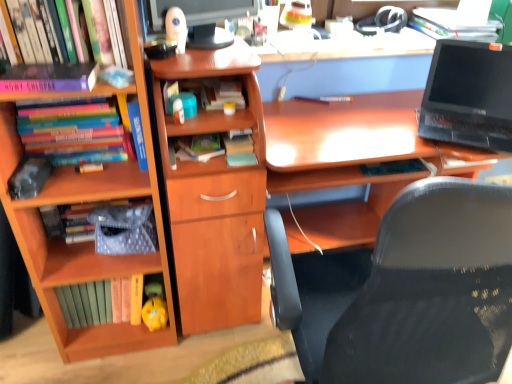
What do you see at coordinates (469, 95) in the screenshot?
I see `black plastic laptop at right` at bounding box center [469, 95].

What do you see at coordinates (87, 242) in the screenshot? I see `wooden bookcase at left` at bounding box center [87, 242].

Describe the element at coordinates (221, 94) in the screenshot. I see `hardcover book at center, the 2th book when ordered from right to left` at that location.

Measure the distance between point (233,90) and camera.

Point (233,90) and camera are 1.34 meters apart.

The image size is (512, 384). I want to click on hardcover book at center, the fourth book when ordered from left to right, so click(x=201, y=146).

This screenshot has height=384, width=512. Describe the element at coordinates (453, 25) in the screenshot. I see `matte black laptop at upper right, the first book when ordered from right to left` at that location.

The height and width of the screenshot is (384, 512). Identify the location of wooden cabinet at center. (215, 198).

From a real-world perspective, which object stands above the other?

In real-world perspective, matte black laptop at upper right, placed as the sixth book when sorted from left to right, is above.

Is black mesh chair at center inside or outside of matte black laptop at upper right, the first book when ordered from right to left?

black mesh chair at center is spatially situated outside matte black laptop at upper right, the first book when ordered from right to left.

In the scene shown: Is black mesh chair at center to the right of matte black laptop at upper right, the first book when ordered from right to left, from the viewer's perspective?

In fact, black mesh chair at center is to the left of matte black laptop at upper right, the first book when ordered from right to left.

Looking at this image, measure the distance from black mesh chair at center to matte black laptop at upper right, the first book when ordered from right to left.

The distance of black mesh chair at center from matte black laptop at upper right, the first book when ordered from right to left, is 1.11 meters.

In the scene shown: Which of these two, hardcover books at left, which ranks as the second book in left-to-right order, or pink matte book at upper left, marked as the 3th book in a left-to-right arrangement, stands shorter?

Standing shorter between the two is pink matte book at upper left, marked as the 3th book in a left-to-right arrangement.

Could you measure the distance between hardcover books at left, placed as the 5th book when sorted from right to left, and pink matte book at upper left, marked as the 3th book in a left-to-right arrangement?

hardcover books at left, placed as the 5th book when sorted from right to left, is 9.24 inches from pink matte book at upper left, marked as the 3th book in a left-to-right arrangement.

From the picture: Is hardcover books at left, which ranks as the second book in left-to-right order, located outside pink matte book at upper left, the fourth book viewed from the right?

That's correct, hardcover books at left, which ranks as the second book in left-to-right order, is outside of pink matte book at upper left, the fourth book viewed from the right.

From a real-world perspective, relative to pink matte book at upper left, the fourth book viewed from the right, is hardcover books at left, which ranks as the second book in left-to-right order, vertically above or below?

In terms of real-world spatial position, hardcover books at left, which ranks as the second book in left-to-right order, is below pink matte book at upper left, the fourth book viewed from the right.

Relative to matte black monitor at upper center, is wooden desk at center in front or behind?

Visually, wooden desk at center is located behind matte black monitor at upper center.

Considering the sizes of wooden desk at center and matte black monitor at upper center in the image, is wooden desk at center taller or shorter than matte black monitor at upper center?

wooden desk at center is taller than matte black monitor at upper center.

From a real-world perspective, is wooden desk at center beneath matte black monitor at upper center?

Yes, from a real-world perspective, wooden desk at center is under matte black monitor at upper center.

Is there a large distance between wooden desk at center and matte black monitor at upper center?

No.

Looking at this image, considering the relative sizes of blue matte book at upper left and hardcover book at center, the 2th book when ordered from right to left, in the image provided, is blue matte book at upper left taller than hardcover book at center, the 2th book when ordered from right to left,?

Yes.

Is blue matte book at upper left wider than hardcover book at center, the 2th book when ordered from right to left?

Correct, the width of blue matte book at upper left exceeds that of hardcover book at center, the 2th book when ordered from right to left.

From the image's perspective, is blue matte book at upper left above or below hardcover book at center, the 5th book in the left-to-right sequence?

From the image's perspective, blue matte book at upper left appears below hardcover book at center, the 5th book in the left-to-right sequence.

Measure the distance from blue matte book at upper left to hardcover book at center, the 2th book when ordered from right to left.

blue matte book at upper left and hardcover book at center, the 2th book when ordered from right to left, are 10.71 inches apart.

From a real-world perspective, which is physically below, wooden desk at center or pink matte book at upper left, marked as the 3th book in a left-to-right arrangement?

From a 3D spatial view, wooden desk at center is below.

From the image's perspective, is wooden desk at center located above or below pink matte book at upper left, the fourth book viewed from the right?

Based on their image positions, wooden desk at center is located beneath pink matte book at upper left, the fourth book viewed from the right.

What's the angular difference between wooden desk at center and pink matte book at upper left, the fourth book viewed from the right,'s facing directions?

The angular difference between wooden desk at center and pink matte book at upper left, the fourth book viewed from the right, is 0.913 degrees.

Between wooden desk at center and pink matte book at upper left, the fourth book viewed from the right, which one has smaller size?

Smaller between the two is pink matte book at upper left, the fourth book viewed from the right.

From a real-world perspective, is wooden bookcase at left over blue matte book at upper left?

Actually, wooden bookcase at left is physically below blue matte book at upper left in the real world.

Could you tell me if wooden bookcase at left is facing blue matte book at upper left?

Yes, wooden bookcase at left is facing blue matte book at upper left.

Can we say wooden bookcase at left lies outside blue matte book at upper left?

Indeed, wooden bookcase at left is completely outside blue matte book at upper left.

Which is further, (151, 341) or (133, 126)?

The point (151, 341) is farther from the camera.

From a real-world perspective, who is located lower, yellow matte piggy bank at lower center or hardcover books at left, which ranks as the second book in left-to-right order?

yellow matte piggy bank at lower center, from a real-world perspective.

Who is bigger, yellow matte piggy bank at lower center or hardcover books at left, which ranks as the second book in left-to-right order?

Bigger between the two is hardcover books at left, which ranks as the second book in left-to-right order.

How distant is yellow matte piggy bank at lower center from hardcover books at left, which ranks as the second book in left-to-right order?

A distance of 59.33 centimeters exists between yellow matte piggy bank at lower center and hardcover books at left, which ranks as the second book in left-to-right order.

Is yellow matte piggy bank at lower center behind hardcover books at left, which ranks as the second book in left-to-right order?

Yes.

There is a black mesh chair at center. Identify the location of the 6th book above it (from the image's perspective). (453, 25).

The height and width of the screenshot is (384, 512). I want to click on the 1st book to the right of the hardcover books at left, which ranks as the second book in left-to-right order, starting your count from the anchor, so click(49, 78).

From the image, which object appears to be farther from hardcover book at upper left, which ranks as the 1th book in left-to-right order, matte black monitor at upper center or matte black laptop at upper right, placed as the sixth book when sorted from left to right?

Based on the image, matte black laptop at upper right, placed as the sixth book when sorted from left to right, appears to be further to hardcover book at upper left, which ranks as the 1th book in left-to-right order.

Estimate the real-world distances between objects in this image. Which object is closer to black mesh chair at center, hardcover book at center, the 5th book in the left-to-right sequence, or hardcover book at upper left, which ranks as the 1th book in left-to-right order?

hardcover book at center, the 5th book in the left-to-right sequence.

Based on their spatial positions, is wooden cabinet at center or hardcover book at center, the 2th book when ordered from right to left, further from matte black laptop at upper right, the first book when ordered from right to left?

wooden cabinet at center is further to matte black laptop at upper right, the first book when ordered from right to left.

Based on the photo, estimate the real-world distances between objects in this image. Which object is closer to hardcover book at center, placed as the third book when sorted from right to left, wooden desk at center or black plastic laptop at right?

wooden desk at center lies closer to hardcover book at center, placed as the third book when sorted from right to left, than the other object.

From the image, which object appears to be nearer to hardcover book at upper left, which ranks as the 1th book in left-to-right order, pink matte book at upper left, marked as the 3th book in a left-to-right arrangement, or black mesh chair at center?

pink matte book at upper left, marked as the 3th book in a left-to-right arrangement, is positioned closer to the anchor hardcover book at upper left, which ranks as the 1th book in left-to-right order.

Looking at the image, which one is located closer to black mesh chair at center, hardcover books at left, placed as the 5th book when sorted from right to left, or matte black monitor at upper center?

hardcover books at left, placed as the 5th book when sorted from right to left, is closer to black mesh chair at center.

Looking at this image, when comparing their distances from matte black laptop at upper right, the first book when ordered from right to left, does matte black monitor at upper center or wooden cabinet at center seem further?

The object further to matte black laptop at upper right, the first book when ordered from right to left, is wooden cabinet at center.

Based on their spatial positions, is blue matte book at upper left or hardcover book at upper left, which ranks as the 1th book in left-to-right order, closer to hardcover books at left, which ranks as the second book in left-to-right order?

blue matte book at upper left lies closer to hardcover books at left, which ranks as the second book in left-to-right order, than the other object.

The width and height of the screenshot is (512, 384). Identify the location of shelf between pink matte book at upper left, marked as the 3th book in a left-to-right arrangement, and wooden desk at center from left to right. (215, 198).

Where is `shelf between wooden bookcase at left and wooden desk at center in the horizontal direction`? The height and width of the screenshot is (384, 512). shelf between wooden bookcase at left and wooden desk at center in the horizontal direction is located at coordinates (215, 198).

Find the location of `toy located between hardcover books at left, which ranks as the second book in left-to-right order, and matte black laptop at upper right, placed as the sixth book when sorted from left to right, in the left-right direction`. toy located between hardcover books at left, which ranks as the second book in left-to-right order, and matte black laptop at upper right, placed as the sixth book when sorted from left to right, in the left-right direction is located at coordinates coord(154,306).

Identify the location of chair situated between hardcover books at left, which ranks as the second book in left-to-right order, and black plastic laptop at right from left to right. (406, 291).